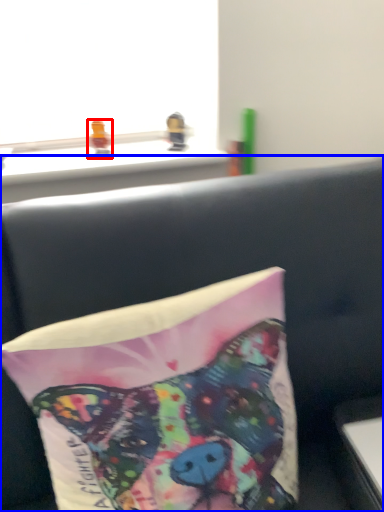
Question: Which of the following is the farthest to the observer, toy (highlighted by a red box) or furniture (highlighted by a blue box)?

Choices:
 (A) toy
 (B) furniture

Answer: (A)